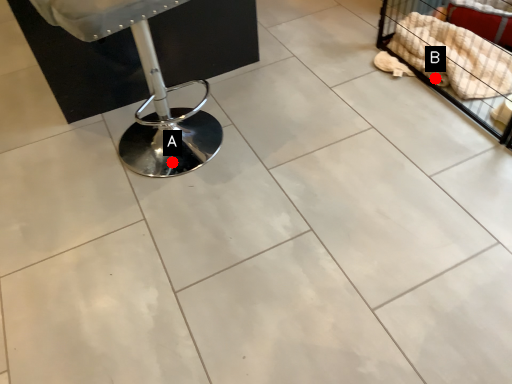
Question: Two points are circled on the image, labeled by A and B beside each circle. Which of the following is the closest to the observer?

Choices:
 (A) A is closer
 (B) B is closer

Answer: (A)